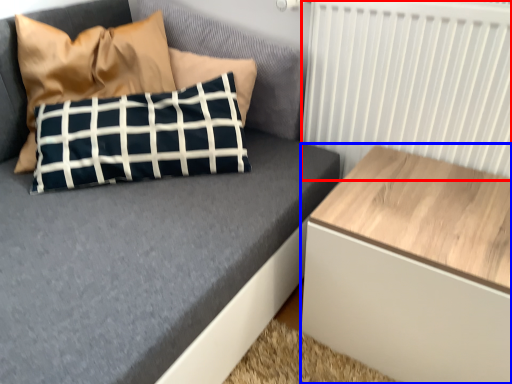
Question: Which point is further to the camera, radiator (highlighted by a red box) or table (highlighted by a blue box)?

Choices:
 (A) radiator
 (B) table

Answer: (A)